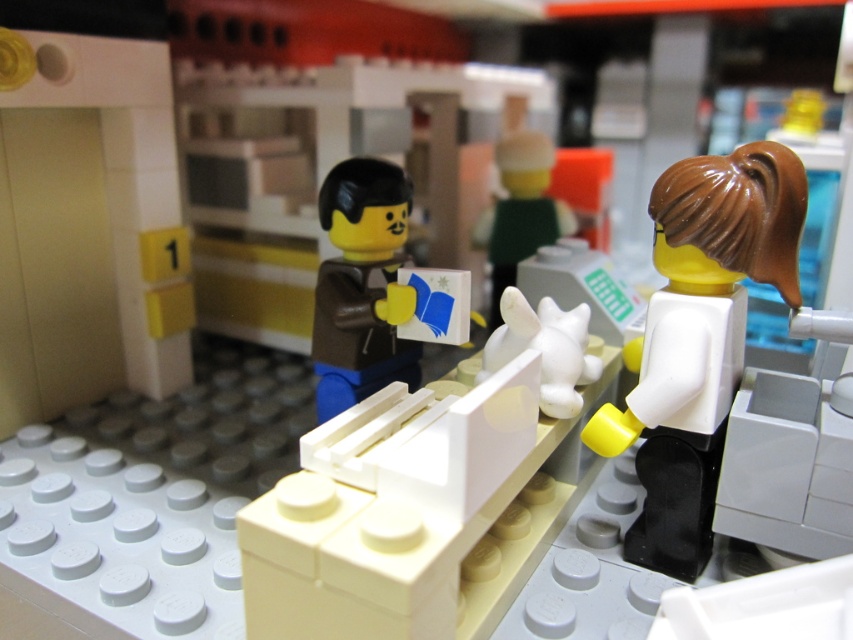
Question: Is brown matte jacket at center in front of white matte rabbit at center?

Choices:
 (A) no
 (B) yes

Answer: (B)

Question: Which point is closer to the camera?

Choices:
 (A) (357, 310)
 (B) (569, 358)

Answer: (B)

Question: Which is nearer to the white matte cat at center?

Choices:
 (A) white matte rabbit at center
 (B) white matte figure at right

Answer: (B)

Question: Which point is farther from the camera taking this photo?

Choices:
 (A) [577, 396]
 (B) [354, 246]
 (C) [548, 218]

Answer: (C)

Question: Is white matte figure at right further to camera compared to brown matte jacket at center?

Choices:
 (A) no
 (B) yes

Answer: (A)

Question: Does brown matte jacket at center have a smaller size compared to white matte cat at center?

Choices:
 (A) yes
 (B) no

Answer: (B)